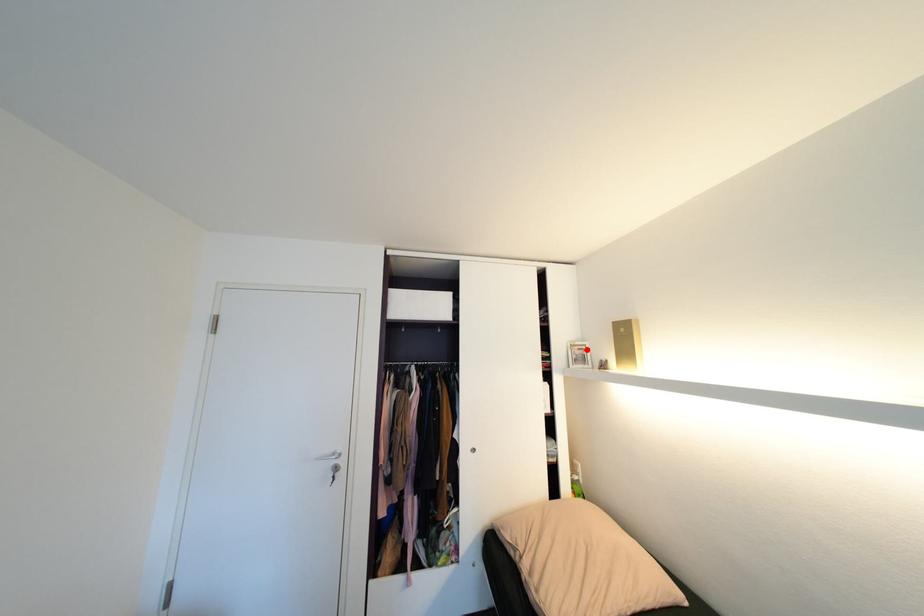
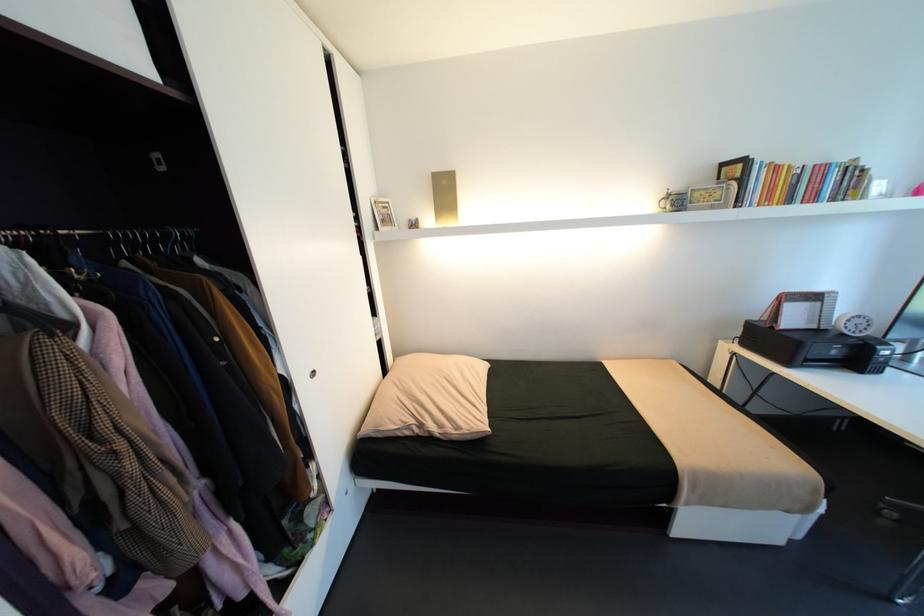
Locate, in the second image, the point that corresponds to the highlighted location in the first image.

(392, 208)